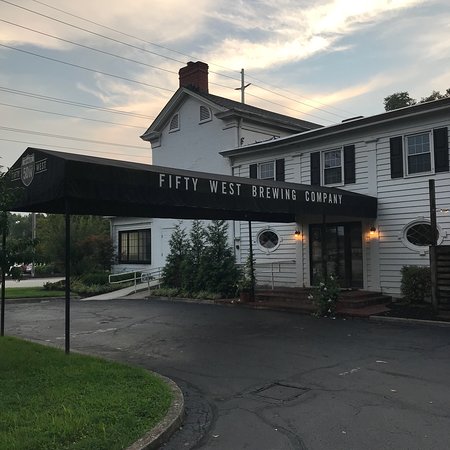
The image size is (450, 450). In order to click on panels in this screenshot , I will do `click(277, 248)`, `click(386, 258)`, `click(377, 189)`, `click(290, 173)`.